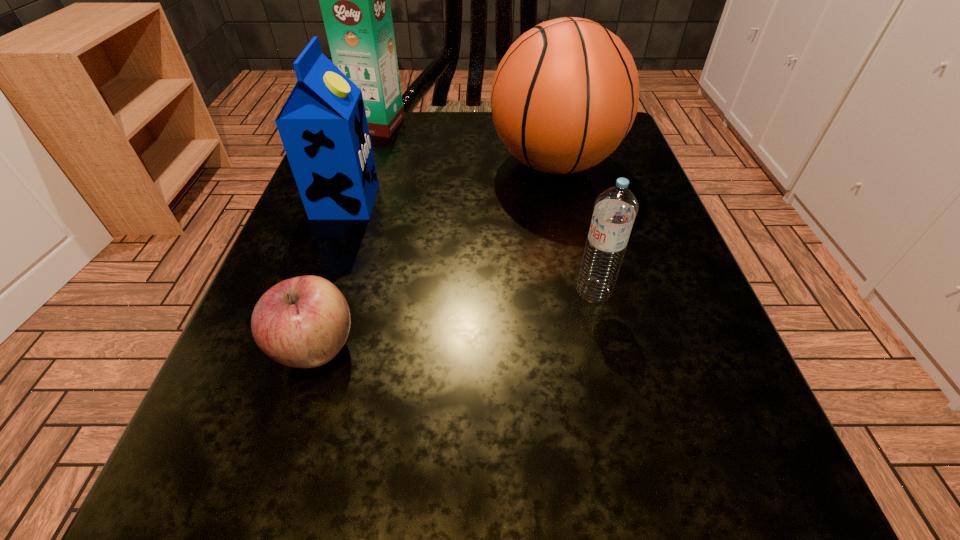
You are a GUI agent. You are given a task and a screenshot of the screen. Output one action in this format:
    pyautogui.click(x=<x>, y=<y>)
    Task: Click on the empty space that is in between the water bottle and the shortest object
    The height and width of the screenshot is (540, 960).
    Given the screenshot: What is the action you would take?
    pyautogui.click(x=455, y=320)

Image resolution: width=960 pixels, height=540 pixels. I want to click on unoccupied area between the basketball and the second nearest object, so click(x=574, y=227).

At what (x,y) coordinates should I click in order to perform the action: click on vacant space in between the nearest object and the basketball. Please return your answer as a coordinate pair (x, y). Image resolution: width=960 pixels, height=540 pixels. Looking at the image, I should click on (435, 256).

Locate an element on the screen. The height and width of the screenshot is (540, 960). the closest object relative to the second shortest object is located at coordinates (564, 96).

Locate an element on the screen. object that ranks as the closest to the shortest object is located at coordinates (323, 127).

At what (x,y) coordinates should I click in order to perform the action: click on free space that satisfies the following two spatial constraints: 1. with the cap open on the fourth tallest object; 2. on the left side of the nearer carton. Please return your answer as a coordinate pair (x, y). The image size is (960, 540). Looking at the image, I should click on (314, 292).

Identify the location of vacant space that satisfies the following two spatial constraints: 1. on the front side of the basketball; 2. on the left side of the farther carton. (364, 164).

Identify the location of vacant space that satisfies the following two spatial constraints: 1. with the cap open on the nearer carton; 2. on the right side of the fourth farthest object. The height and width of the screenshot is (540, 960). (314, 292).

The height and width of the screenshot is (540, 960). What are the coordinates of `vacant space that satisfies the following two spatial constraints: 1. with the cap open on the nearer carton; 2. on the right side of the shortest object` in the screenshot? It's located at (294, 349).

Locate an element on the screen. The height and width of the screenshot is (540, 960). blank space that satisfies the following two spatial constraints: 1. with the cap open on the nearer carton; 2. on the left side of the fourth farthest object is located at coordinates (314, 292).